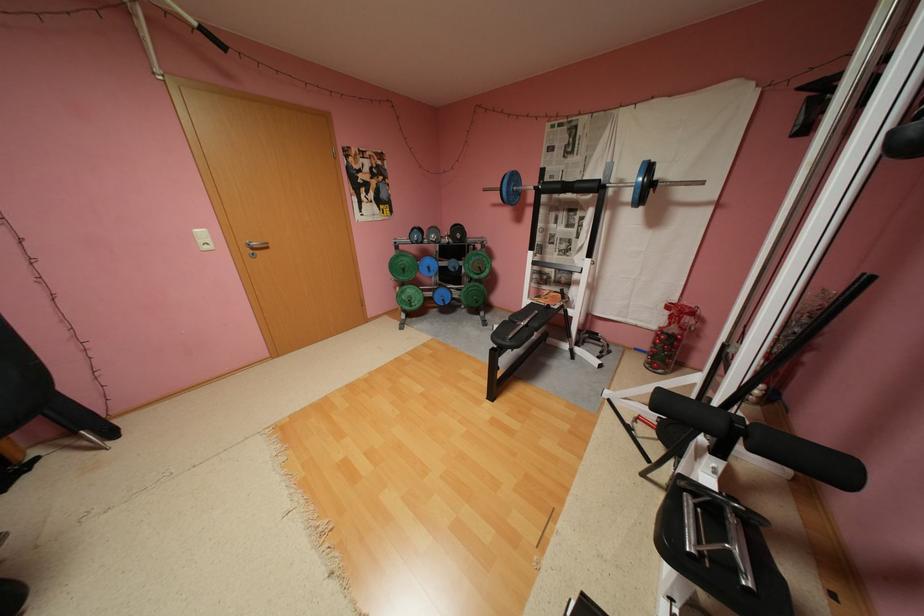
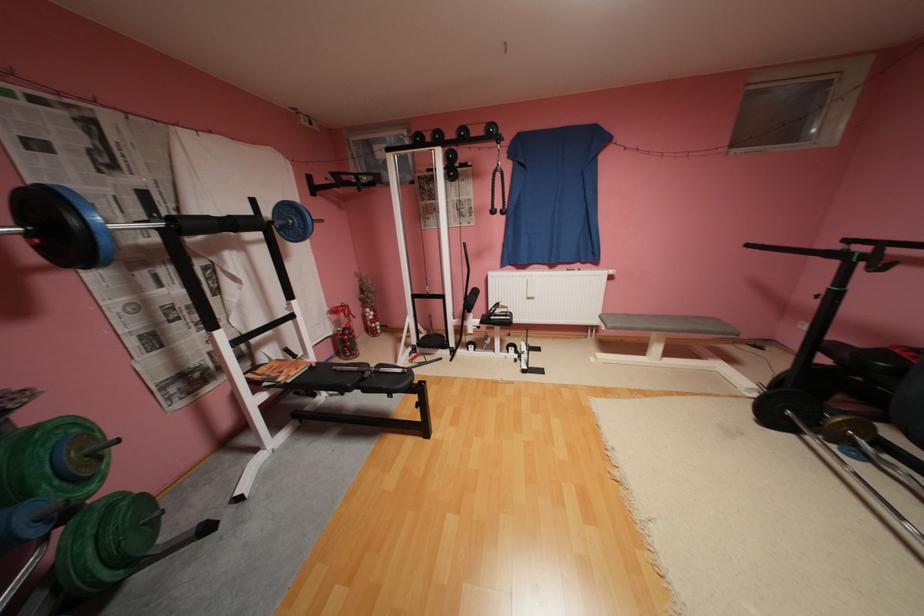
The point at (473,290) is marked in the first image. Where is the corresponding point in the second image?

(100, 551)